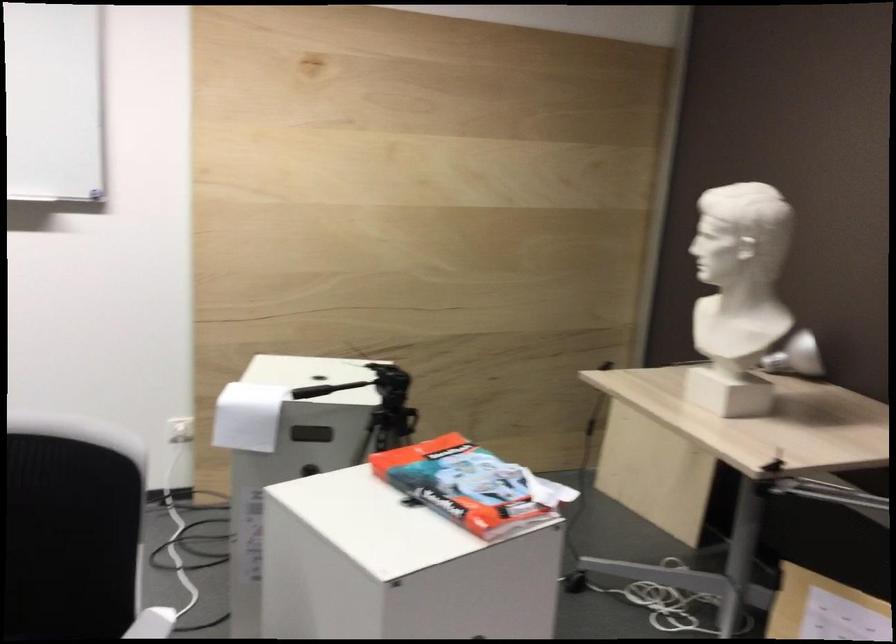
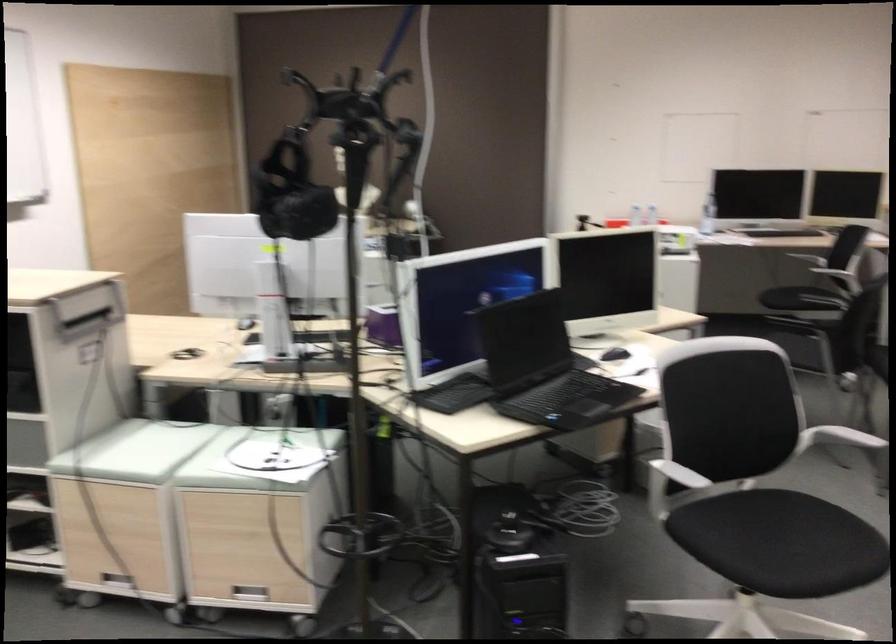
Question: I am providing you with two images of the same scene from different viewpoints. After the viewpoint changes to image2, which objects are now occluded?

Choices:
 (A) metal drawer handle
 (B) net clamp screw
 (C) white electrical plug
 (D) black chair sitting surface

Answer: (C)